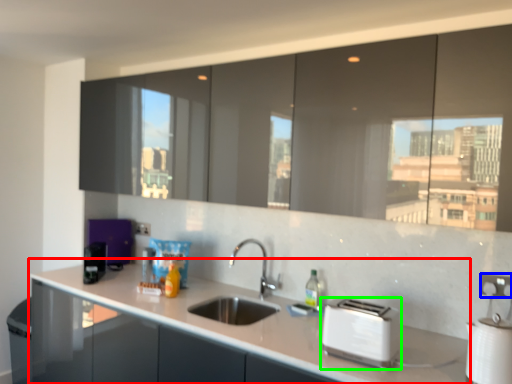
Question: Considering the real-world distances, which object is closest to countertop (highlighted by a red box)? electric outlet (highlighted by a blue box) or toaster (highlighted by a green box).

Choices:
 (A) electric outlet
 (B) toaster

Answer: (B)